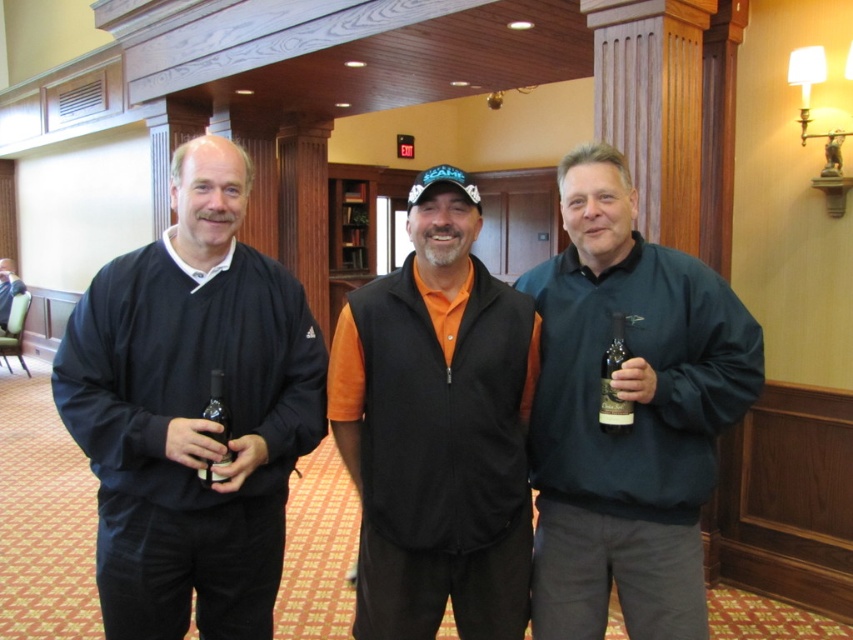
Is black matte sweater at left below translucent glass bottle at center?

No, black matte sweater at left is not below translucent glass bottle at center.

Is black matte sweater at left further to camera compared to translucent glass bottle at center?

No, black matte sweater at left is closer to the viewer.

Locate an element on the screen. The height and width of the screenshot is (640, 853). black matte sweater at left is located at coordinates (192, 410).

You are a GUI agent. You are given a task and a screenshot of the screen. Output one action in this format:
    pyautogui.click(x=<x>, y=<y>)
    Task: Click on the black matte sweater at left
    Image resolution: width=853 pixels, height=640 pixels.
    Given the screenshot: What is the action you would take?
    tap(192, 410)

Can you confirm if dark green sweater at center is positioned above orange fleece vest at center?

Yes, dark green sweater at center is above orange fleece vest at center.

Who is more forward, (599, 218) or (410, 310)?

Point (410, 310) is in front.

Find the location of a particular element. The height and width of the screenshot is (640, 853). dark green sweater at center is located at coordinates (633, 417).

Does black matte sweater at left have a lesser width compared to orange fleece vest at center?

No.

Does black matte sweater at left appear over orange fleece vest at center?

→ Yes.

Who is more distant from viewer, (x=242, y=481) or (x=459, y=540)?

The point (x=459, y=540) is behind.

Locate an element on the screen. This screenshot has height=640, width=853. black matte sweater at left is located at coordinates (192, 410).